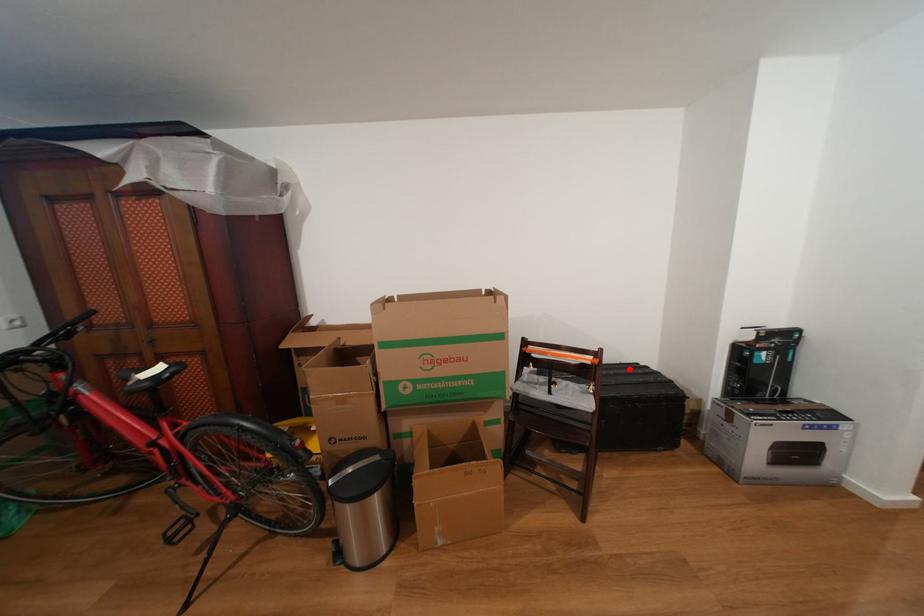
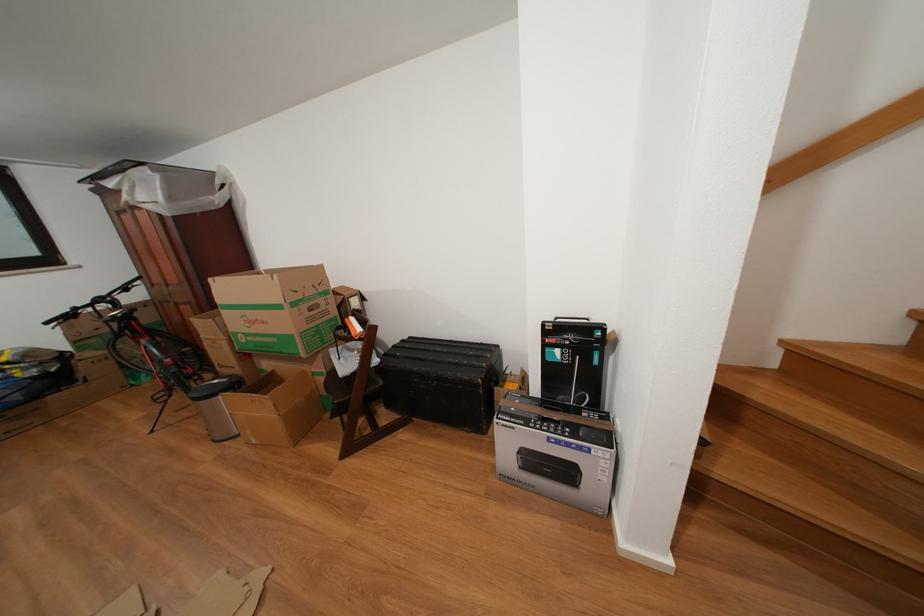
Locate, in the second image, the point that corresponds to the highlighted location in the first image.

(490, 349)